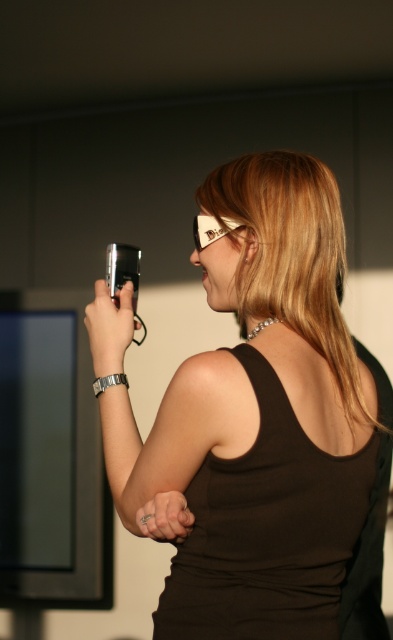
Is silver metallic ring at center shorter than black plastic game controller at upper left?

Correct, silver metallic ring at center is not as tall as black plastic game controller at upper left.

This screenshot has width=393, height=640. Identify the location of silver metallic ring at center. pos(165,516).

This screenshot has width=393, height=640. What are the coordinates of `silver metallic ring at center` in the screenshot? It's located at (165, 516).

Is matte black tank top at center positioned before black plastic game controller at upper left?

Yes.

The width and height of the screenshot is (393, 640). I want to click on matte black tank top at center, so click(x=258, y=419).

Which is more to the left, black matte tank top at back or silver metallic ring at center?

silver metallic ring at center

Can you confirm if black matte tank top at back is positioned below silver metallic ring at center?

Yes.

Who is more forward, (304, 529) or (172, 532)?

Point (172, 532) is in front.

Where is `black matte tank top at back`? black matte tank top at back is located at coordinates point(280,536).